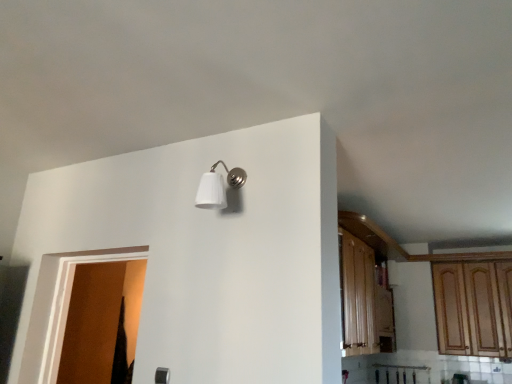
The height and width of the screenshot is (384, 512). Identify the location of wooden cabinet at right. (473, 308).

Which of these two, wooden cabinet at right or white matte wall sconce at upper center, is wider?

wooden cabinet at right.

At what (x,y) coordinates should I click in order to perform the action: click on cabinetry below the white matte wall sconce at upper center (from the image's perspective). Please return your answer as a coordinate pair (x, y). The image size is (512, 384). Looking at the image, I should click on (473, 308).

Which is farther from the camera, [437,286] or [231,170]?

Positioned behind is point [437,286].

How different are the orientations of brown matte door at left and white matte wall sconce at upper center in degrees?

brown matte door at left and white matte wall sconce at upper center are facing 178 degrees away from each other.

Does brown matte door at left lie behind white matte wall sconce at upper center?

Yes, it is behind white matte wall sconce at upper center.

Looking at this image, from the image's perspective, which one is positioned lower, brown matte door at left or white matte wall sconce at upper center?

brown matte door at left is shown below in the image.

Considering the positions of objects white matte wall sconce at upper center and brown matte door at left in the image provided, who is more to the right, white matte wall sconce at upper center or brown matte door at left?

white matte wall sconce at upper center is more to the right.

From a real-world perspective, is white matte wall sconce at upper center physically located above or below brown matte door at left?

Clearly, from a real-world perspective, white matte wall sconce at upper center is above brown matte door at left.

What's the angular difference between white matte wall sconce at upper center and brown matte door at left's facing directions?

178 degrees separate the facing orientations of white matte wall sconce at upper center and brown matte door at left.

In the scene shown: Which is behind, white matte wall sconce at upper center or brown matte door at left?

brown matte door at left is further from the camera.

Considering the relative positions of wooden cabinet at right and brown matte door at left in the image provided, is wooden cabinet at right to the left of brown matte door at left from the viewer's perspective?

No.

Relative to brown matte door at left, is wooden cabinet at right in front or behind?

In the image, wooden cabinet at right appears behind brown matte door at left.

This screenshot has height=384, width=512. I want to click on door on the left side of wooden cabinet at right, so click(59, 307).

Is wooden cabinet at right facing towards brown matte door at left?

No, wooden cabinet at right does not turn towards brown matte door at left.

Which is nearer, [55,373] or [483,330]?

Point [55,373] is closer to the camera than point [483,330].

Which object is positioned more to the left, brown matte door at left or wooden cabinet at right?

brown matte door at left.

Would you say brown matte door at left is inside or outside wooden cabinet at right?

brown matte door at left exists outside the volume of wooden cabinet at right.

This screenshot has height=384, width=512. I want to click on door on the left of wooden cabinet at right, so click(59, 307).

From a real-world perspective, is white matte wall sconce at upper center positioned above or below wooden cabinet at right?

white matte wall sconce at upper center is situated higher than wooden cabinet at right in the real world.

Is point (221, 182) closer or farther from the camera than point (450, 335)?

Clearly, point (221, 182) is closer to the camera than point (450, 335).

Is white matte wall sconce at upper center touching wooden cabinet at right?

white matte wall sconce at upper center and wooden cabinet at right are clearly separated.

In order to click on cabinetry behind the white matte wall sconce at upper center in this screenshot , I will do `click(473, 308)`.

Find the location of a particular element. door lying below the white matte wall sconce at upper center (from the image's perspective) is located at coordinates tap(59, 307).

Looking at the image, which one is located closer to white matte wall sconce at upper center, wooden cabinet at right or brown matte door at left?

brown matte door at left is positioned closer to the anchor white matte wall sconce at upper center.

Considering their positions, is white matte wall sconce at upper center positioned further to wooden cabinet at right than brown matte door at left?

Based on the image, brown matte door at left appears to be further to wooden cabinet at right.

Looking at the image, which one is located closer to brown matte door at left, wooden cabinet at right or white matte wall sconce at upper center?

Based on the image, white matte wall sconce at upper center appears to be nearer to brown matte door at left.

Looking at this image, from the image, which object appears to be nearer to brown matte door at left, white matte wall sconce at upper center or wooden cabinet at right?

white matte wall sconce at upper center is closer to brown matte door at left.

From the picture: Looking at the image, which one is located further to white matte wall sconce at upper center, brown matte door at left or wooden cabinet at right?

wooden cabinet at right lies further to white matte wall sconce at upper center than the other object.

Which object lies nearer to the anchor point wooden cabinet at right, brown matte door at left or white matte wall sconce at upper center?

Based on the image, white matte wall sconce at upper center appears to be nearer to wooden cabinet at right.

You are a GUI agent. You are given a task and a screenshot of the screen. Output one action in this format:
    pyautogui.click(x=<x>, y=<y>)
    Task: Click on the light fixture between brown matte door at left and wooden cabinet at right
    
    Given the screenshot: What is the action you would take?
    pyautogui.click(x=218, y=187)